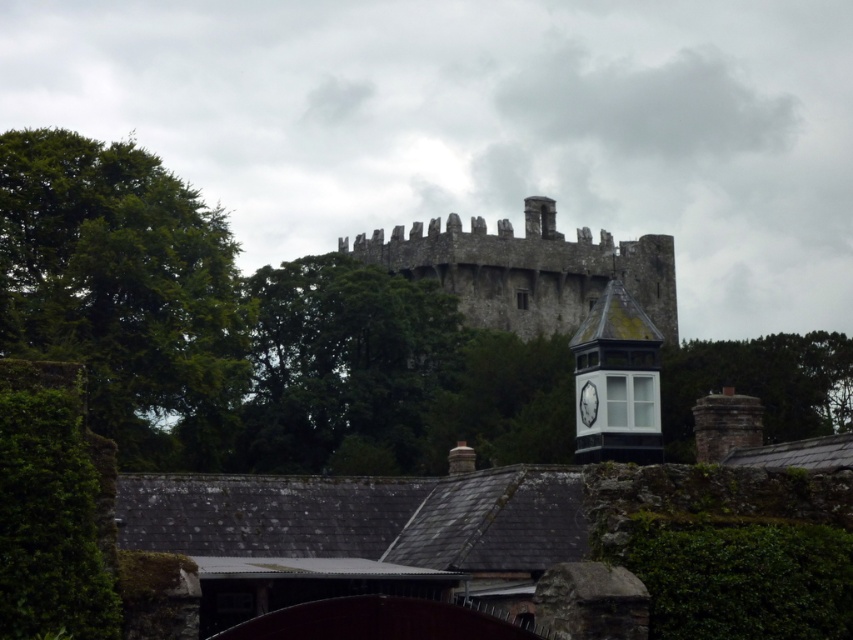
Question: From the image, what is the correct spatial relationship of green leafy tree at right in relation to white glossy clock at upper center?

Choices:
 (A) above
 (B) below

Answer: (B)

Question: Which object is positioned farthest from the white glass clock tower at upper center?

Choices:
 (A) green leafy tree at left
 (B) white glossy clock at upper center
 (C) dark gray stone castle at center

Answer: (C)

Question: Does green leafy tree at left have a larger size compared to white glossy clock at upper center?

Choices:
 (A) yes
 (B) no

Answer: (A)

Question: Which object is the farthest from the green leafy tree at left?

Choices:
 (A) dark gray stone castle at center
 (B) green leafy tree at right
 (C) white glass clock tower at upper center
 (D) white glossy clock at upper center

Answer: (C)

Question: Considering the relative positions of dark gray stone castle at center and green leafy tree at right in the image provided, where is dark gray stone castle at center located with respect to green leafy tree at right?

Choices:
 (A) right
 (B) left

Answer: (B)

Question: Which of these objects is positioned closest to the white glass clock tower at upper center?

Choices:
 (A) green leafy tree at left
 (B) white glossy clock at upper center
 (C) green leafy tree at right
 (D) dark gray stone castle at center

Answer: (B)